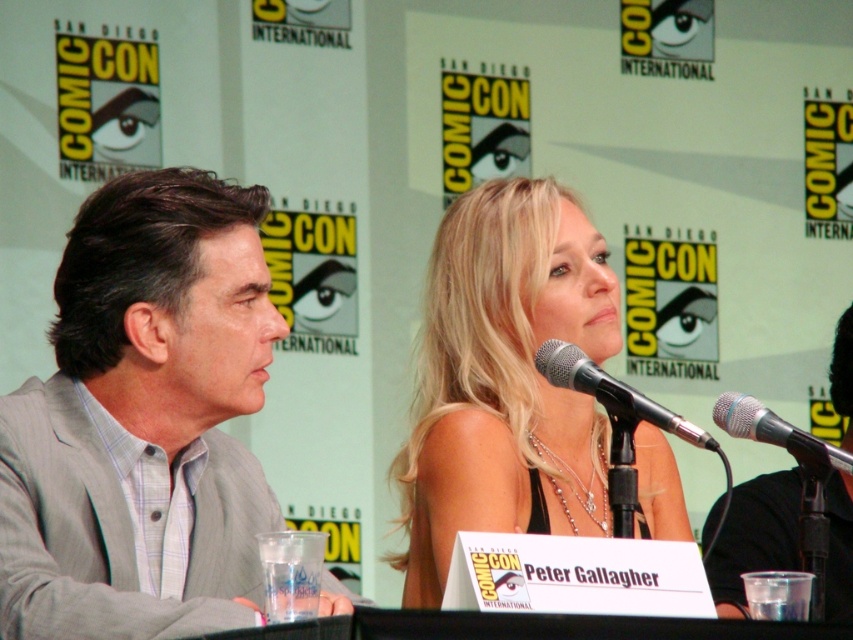
You are a photographer at Comic Con. You want to take a photo of the gray pinstriped suit at left and the black metallic microphone at center so that both are in focus. The camera you are using has a depth of field that can cover 4 feet. Will both objects be in focus in the photo?

The gray pinstriped suit at left and black metallic microphone at center are 3.89 feet apart from each other. Since the distance between them is less than the camera depth of field of 4 feet, both objects will be in focus in the photo.

You are a photographer at Comic Con and need to capture a clear photo of the nameplate in front of the woman with the blonde hair at center. The silver metallic microphone at center is blocking the view. Can you adjust your camera angle to see the nameplate without moving the microphone?

The blonde hair at center is taller than the silver metallic microphone at center, so adjusting the camera angle downward might allow you to see the nameplate without moving the microphone.

You are a photographer at Comic Con. You want to take a photo of the gray pinstriped suit at left and the black metallic microphone at center. Based on their positions, which object should you focus on first if you want to capture both in a single shot without moving the camera?

The gray pinstriped suit at left is below the black metallic microphone at center, so you should focus on the black metallic microphone at center first to ensure both are in frame.